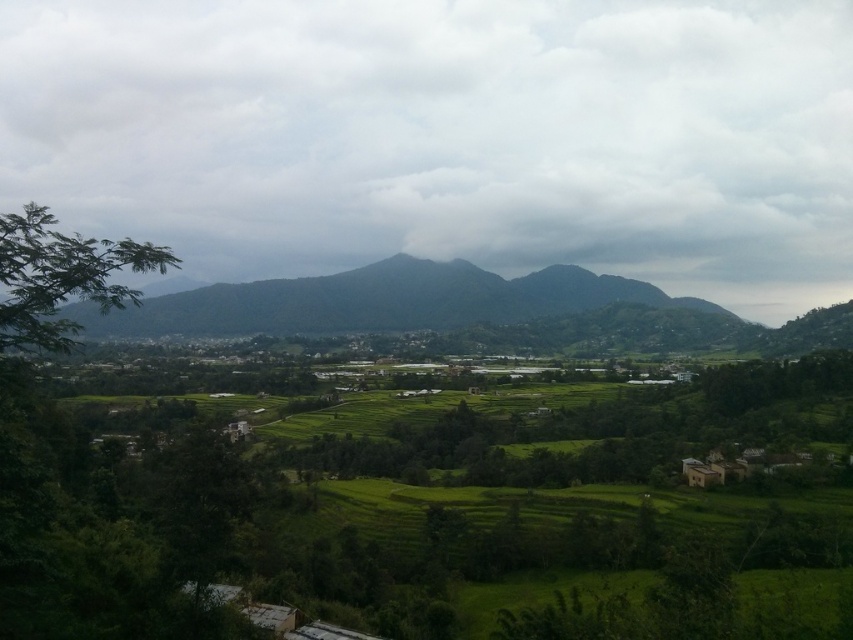
Is cloudy gray sky at upper center above green leafy tree at left?

Correct, cloudy gray sky at upper center is located above green leafy tree at left.

Where is `cloudy gray sky at upper center`? This screenshot has height=640, width=853. cloudy gray sky at upper center is located at coordinates (447, 136).

Find the location of `cloudy gray sky at upper center`. cloudy gray sky at upper center is located at coordinates (447, 136).